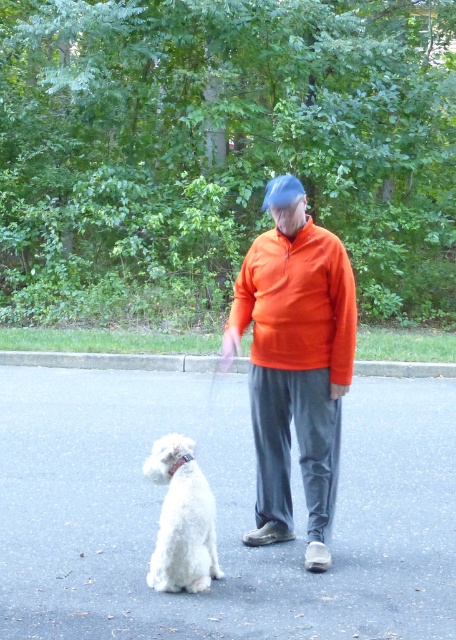
Who is higher up, orange fleece jacket at center or white fluffy dog at lower left?

orange fleece jacket at center

Between point (285, 225) and point (202, 486), which one is positioned behind?

The point (285, 225) is behind.

Identify the location of orange fleece jacket at center. The height and width of the screenshot is (640, 456). click(295, 364).

Can you confirm if orange fleece sweatshirt at center is shorter than white fluffy dog at lower left?

Incorrect, orange fleece sweatshirt at center's height does not fall short of white fluffy dog at lower left's.

Image resolution: width=456 pixels, height=640 pixels. Describe the element at coordinates (298, 301) in the screenshot. I see `orange fleece sweatshirt at center` at that location.

Who is more forward, (345, 323) or (186, 561)?

Point (186, 561) is in front.

Where is `orange fleece sweatshirt at center`? This screenshot has height=640, width=456. orange fleece sweatshirt at center is located at coordinates (298, 301).

Between orange fleece jacket at center and orange fleece sweatshirt at center, which one appears on the left side from the viewer's perspective?

From the viewer's perspective, orange fleece jacket at center appears more on the left side.

Which is in front, point (265, 416) or point (271, 317)?

Point (271, 317) is in front.

You are a GUI agent. You are given a task and a screenshot of the screen. Output one action in this format:
    pyautogui.click(x=<x>, y=<y>)
    Task: Click on the orange fleece jacket at center
    The width and height of the screenshot is (456, 640).
    Given the screenshot: What is the action you would take?
    pyautogui.click(x=295, y=364)